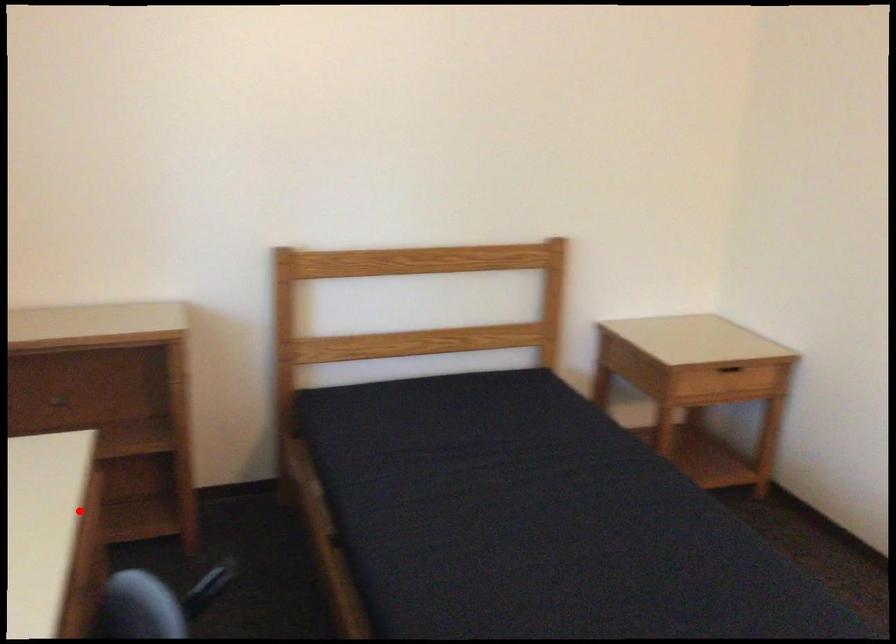
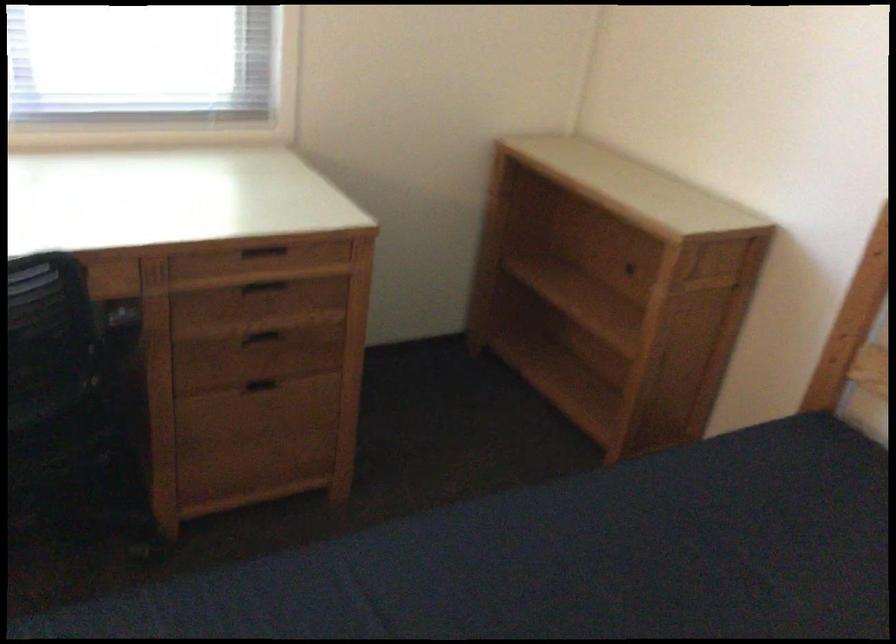
Where in the second image is the point corresponding to the highlighted location from the first image?

(263, 252)